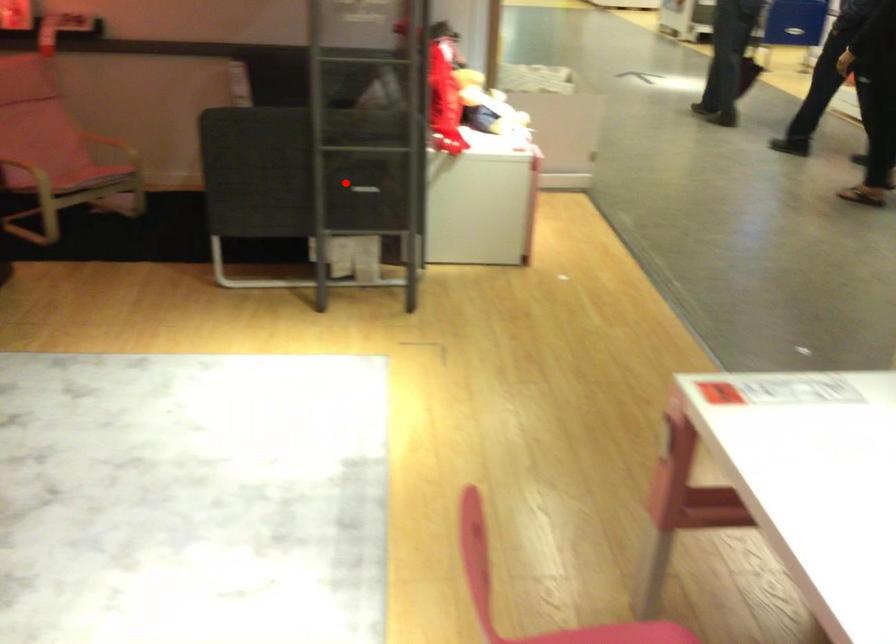
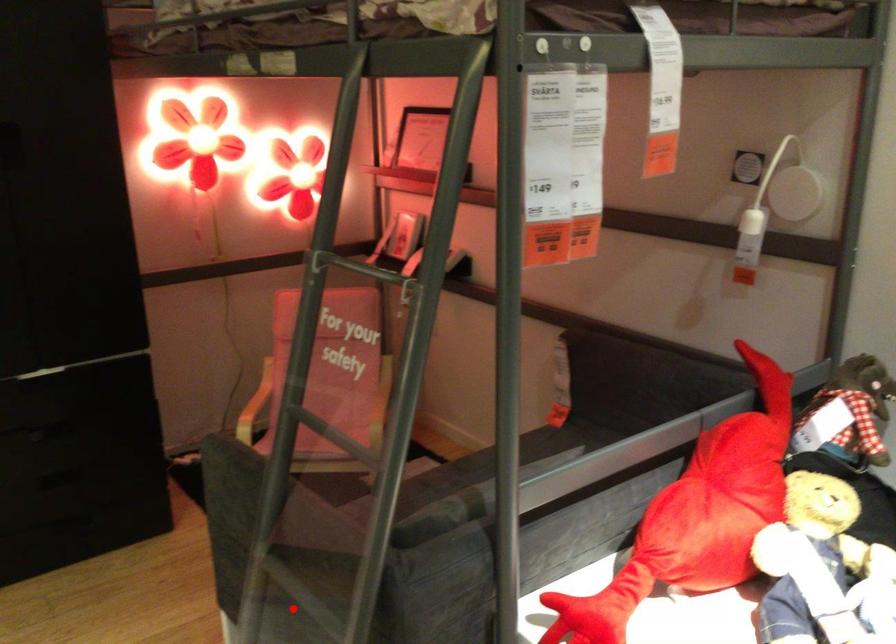
I am providing you with two images of the same scene from different viewpoints. A red point is marked on the first image and another point is marked on the second image. Does the point marked in image1 correspond to the same location as the one in image2?

Yes